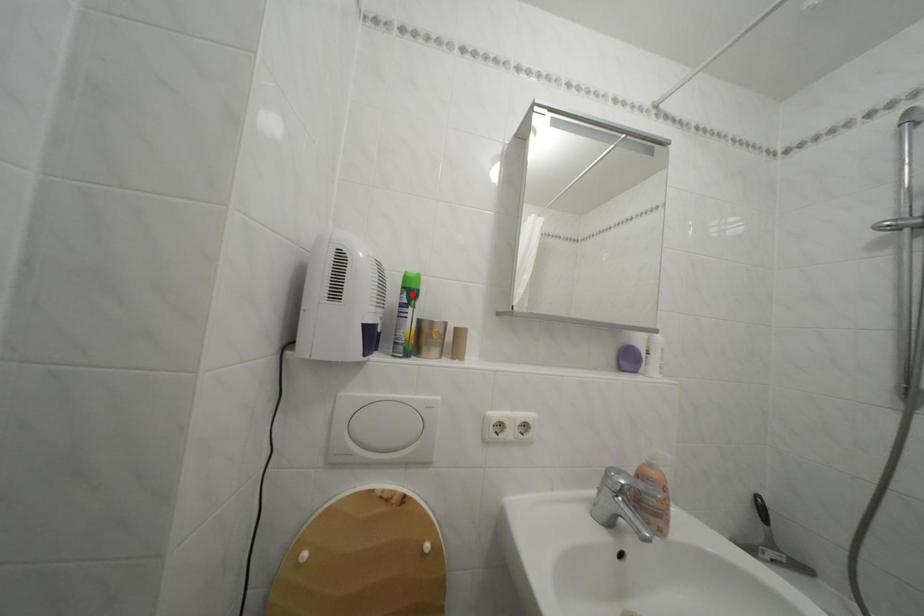
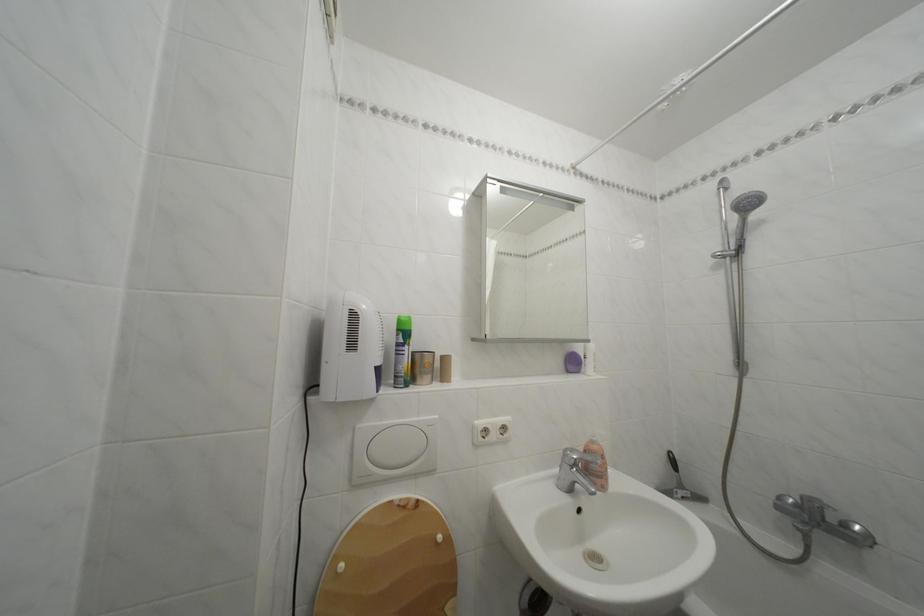
Locate, in the second image, the point that corresponds to the highlighted location in the first image.

(407, 336)